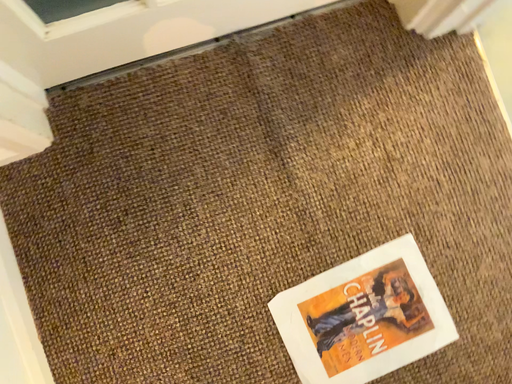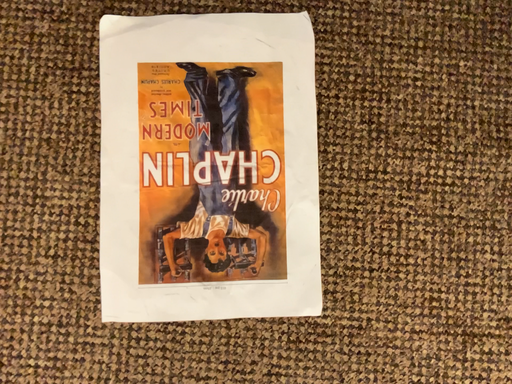
Question: How did the camera likely rotate when shooting the video?

Choices:
 (A) rotated upward
 (B) rotated downward

Answer: (A)